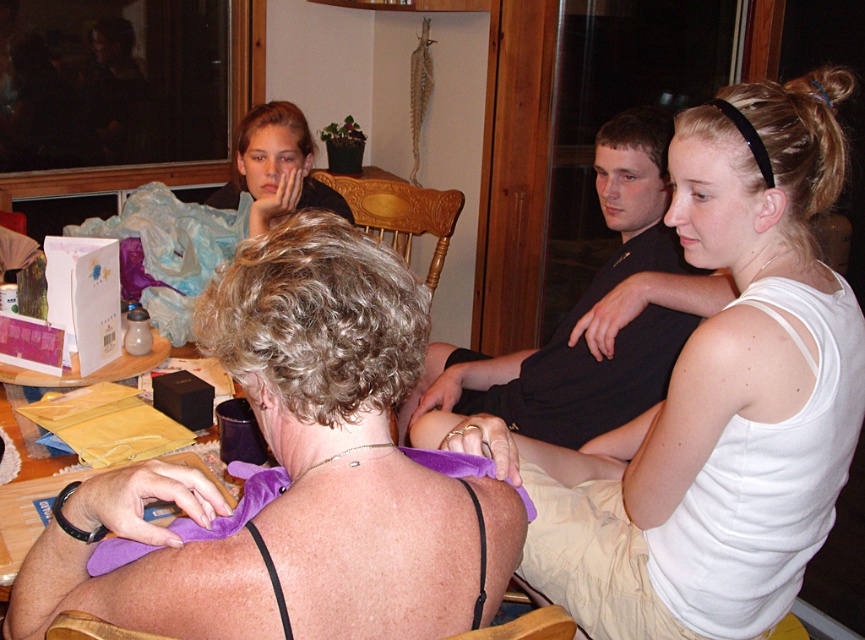
You are standing in the room and looking at the two points marked in the image. Which point, point (687, 237) or point (655, 275), is closer to you?

Point (687, 237) is closer to the camera than point (655, 275), so it is closer to you.

You are organizing a laundry day and have two garments to wash. You have a white cotton tank top at upper right and a matte black shirt at upper center. Which garment has a larger size?

The white cotton tank top at upper right is bigger than the matte black shirt at upper center, so the white cotton tank top at upper right has a larger size.

You are standing in the room and want to place a new decorative item at coordinate point 0.6, 0.8. Is there enough space between the white cotton tank top at upper right and the nearest object to place it there?

The white cotton tank top at upper right is located at point (721, 396). Since the desired placement is at (692, 384), which is close but not overlapping, there might be enough space depending on the size of the decorative item. However, without knowing the size of the nearest object or the item, it is difficult to confirm definitively.